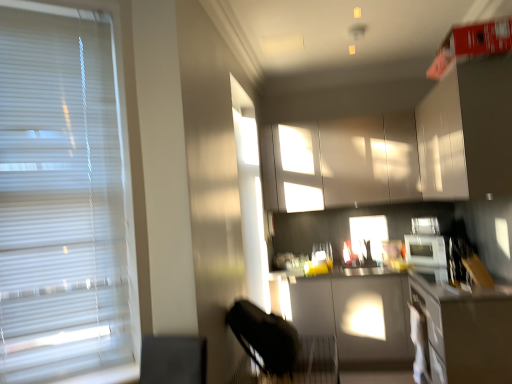
Question: From their relative heights in the image, would you say white glossy microwave at right is taller or shorter than white blinds at left?

Choices:
 (A) tall
 (B) short

Answer: (B)

Question: Visually, is white glossy microwave at right positioned to the left or to the right of white blinds at left?

Choices:
 (A) left
 (B) right

Answer: (B)

Question: Which object is positioned closest to the white glossy cabinet at upper right, the 1th cabinetry positioned from the front?

Choices:
 (A) matte gray countertop at center, arranged as the second counter top when ordered from the bottom
 (B) white blinds at left
 (C) smooth gray countertop at lower right, arranged as the 1th counter top when ordered from the bottom
 (D) white glossy microwave at right
 (E) black leather swivel chair at lower center

Answer: (A)

Question: Which object is positioned farthest from the white glossy microwave at right?

Choices:
 (A) white blinds at left
 (B) matte gray countertop at center, arranged as the second counter top when ordered from the bottom
 (C) smooth gray countertop at lower right, which appears as the 2th counter top when viewed from the top
 (D) white glossy cabinet at upper right, which appears as the 2th cabinetry when viewed from the back
 (E) black leather swivel chair at lower center

Answer: (A)